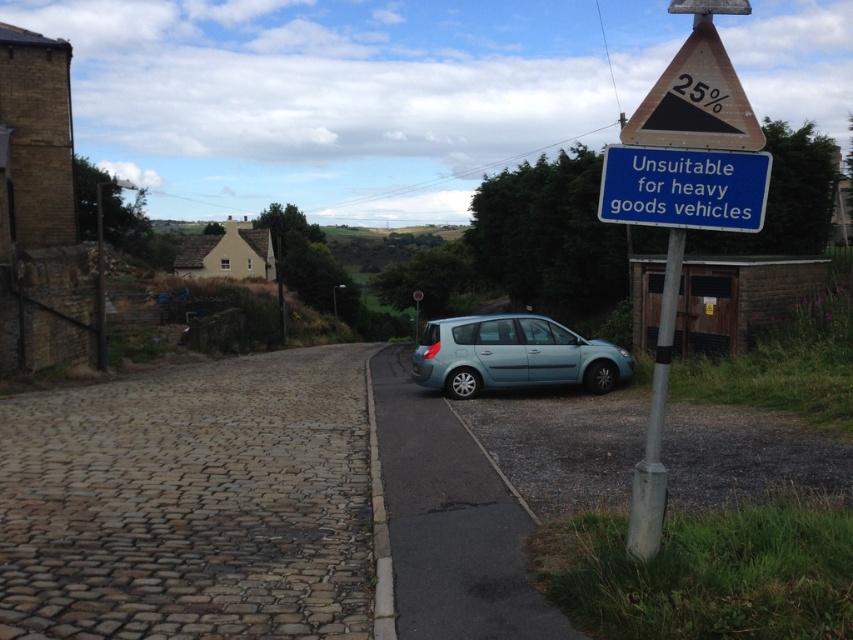
Question: Based on their relative distances, which object is nearer to the wooden triangular sign at upper right?

Choices:
 (A) silver metallic pole at right
 (B) light blue metallic car at center

Answer: (A)

Question: Is wooden triangular sign at upper right closer to camera compared to silver metallic pole at right?

Choices:
 (A) yes
 (B) no

Answer: (B)

Question: Considering the real-world distances, which object is farthest from the blue metallic sign at upper right?

Choices:
 (A) light blue metallic car at center
 (B) silver metallic pole at right

Answer: (A)

Question: Which of the following is the farthest from the observer?

Choices:
 (A) blue metallic sign at upper right
 (B) silver metallic pole at right

Answer: (A)

Question: Can you confirm if blue metallic sign at upper right is positioned above wooden triangular sign at upper right?

Choices:
 (A) no
 (B) yes

Answer: (A)

Question: Can you confirm if blue metallic sign at upper right is wider than wooden triangular sign at upper right?

Choices:
 (A) yes
 (B) no

Answer: (B)